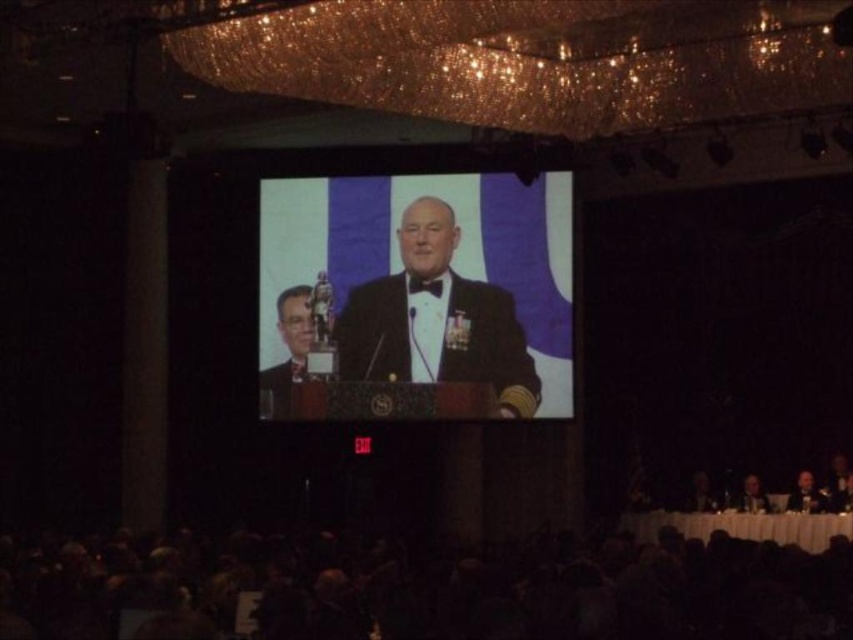
Question: Which point is farther to the camera?

Choices:
 (A) (761, 497)
 (B) (482, 339)
 (C) (790, 497)
 (D) (283, 388)

Answer: (D)

Question: Among these objects, which one is nearest to the camera?

Choices:
 (A) smooth skin face at lower right
 (B) dark suit at lower right
 (C) matte black suit at center

Answer: (B)

Question: From the image, what is the correct spatial relationship of dark suit at lower right in relation to smooth skin face at lower right?

Choices:
 (A) left
 (B) right

Answer: (B)

Question: Is satin black suit at center to the left of dark suit at lower right from the viewer's perspective?

Choices:
 (A) no
 (B) yes

Answer: (B)

Question: Is satin black suit at center positioned in front of smooth skin face at lower right?

Choices:
 (A) yes
 (B) no

Answer: (B)

Question: Which point is closer to the camera taking this photo?

Choices:
 (A) (746, 504)
 (B) (321, 332)
 (C) (817, 492)
 (D) (527, 408)

Answer: (C)